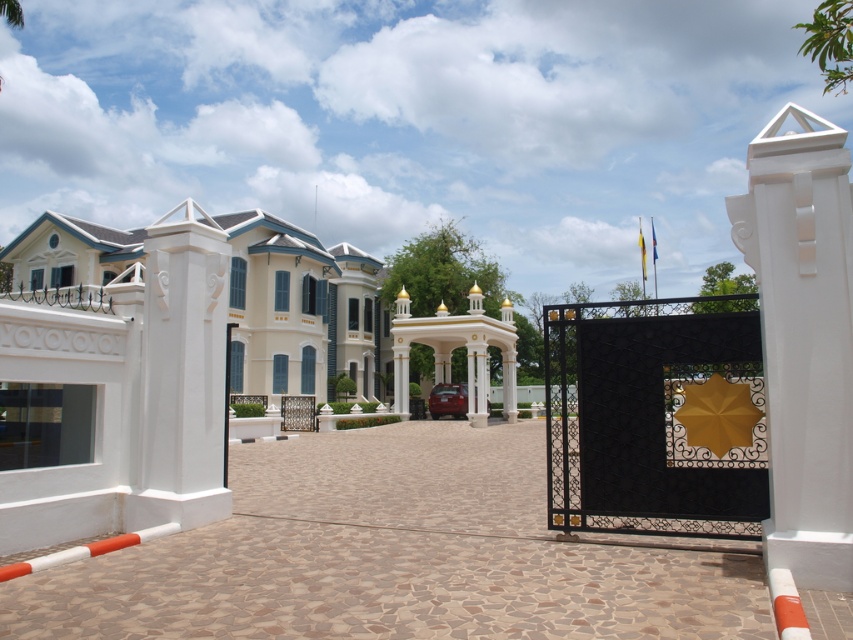
Question: Where is black wrought iron gate at center located in relation to shiny red car at center in the image?

Choices:
 (A) below
 (B) above

Answer: (B)

Question: Which point is closer to the camera?

Choices:
 (A) (222, 577)
 (B) (752, 264)

Answer: (A)

Question: Estimate the real-world distances between objects in this image. Which object is farther from the shiny red car at center?

Choices:
 (A) white smooth column at center
 (B) black wrought iron gate at center
 (C) white smooth pillar at right

Answer: (C)

Question: Can you confirm if black wrought iron gate at center is positioned to the right of white glossy building at center?

Choices:
 (A) no
 (B) yes

Answer: (B)

Question: Which is nearer to the brown mosaic driveway at center?

Choices:
 (A) white smooth pillar at right
 (B) black wrought iron gate at center

Answer: (B)

Question: Does brown mosaic driveway at center lie in front of black wrought iron gate at center?

Choices:
 (A) no
 (B) yes

Answer: (B)